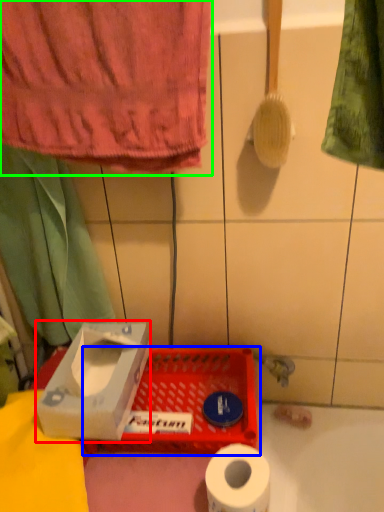
Question: Based on their relative distances, which object is farther from cardboard box (highlighted by a red box)? Choose from basket (highlighted by a blue box) and towel (highlighted by a green box).

Choices:
 (A) basket
 (B) towel

Answer: (B)